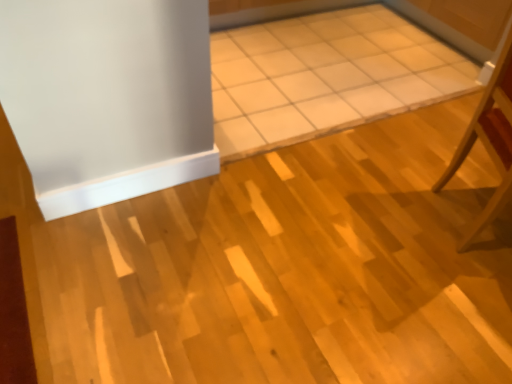
Measure the distance between wooden folding chair at right and camera.

The depth of wooden folding chair at right is 5.04 feet.

What do you see at coordinates (490, 140) in the screenshot? I see `wooden folding chair at right` at bounding box center [490, 140].

The height and width of the screenshot is (384, 512). I want to click on wooden folding chair at right, so click(490, 140).

This screenshot has height=384, width=512. I want to click on wooden folding chair at right, so click(490, 140).